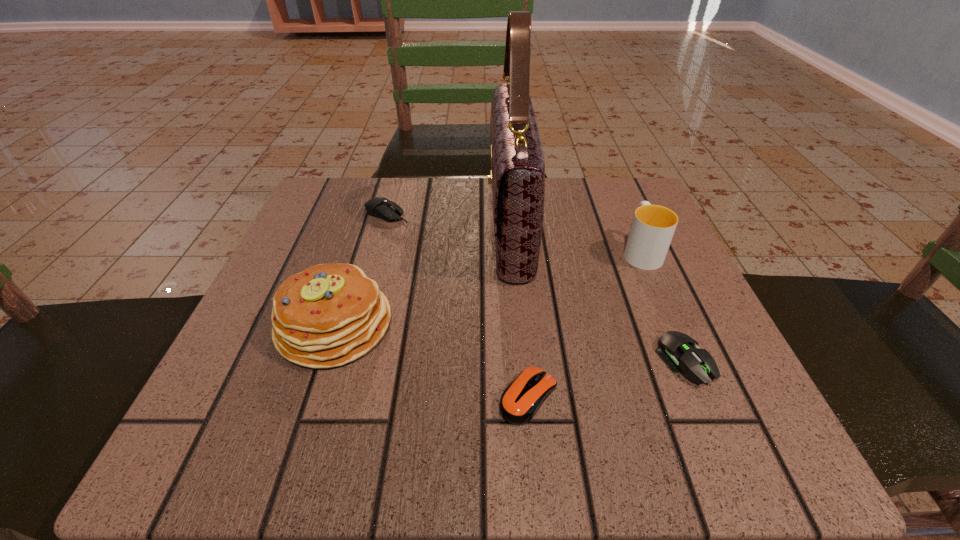
The width and height of the screenshot is (960, 540). I want to click on the tallest object, so click(517, 176).

What are the coordinates of `cup` in the screenshot? It's located at pos(653,226).

This screenshot has height=540, width=960. Identify the location of pancake. (328, 315).

The height and width of the screenshot is (540, 960). I want to click on the leftmost computer mouse, so click(383, 208).

The image size is (960, 540). What are the coordinates of `the second computer mouse from left to right` in the screenshot? It's located at (521, 400).

What are the coordinates of `the rightmost computer mouse` in the screenshot? It's located at (675, 348).

The width and height of the screenshot is (960, 540). I want to click on vacant region located 0.050m on the front of the handbag with the clasp, so click(463, 224).

You are a GUI agent. You are given a task and a screenshot of the screen. Output one action in this format:
    pyautogui.click(x=<x>, y=<y>)
    Task: Click on the free space located on the front of the handbag with the clasp
    
    Given the screenshot: What is the action you would take?
    pyautogui.click(x=429, y=224)

Where is `blank space located on the front of the handbag with the clasp`? blank space located on the front of the handbag with the clasp is located at coordinates (356, 224).

You are a GUI agent. You are given a task and a screenshot of the screen. Output one action in this format:
    pyautogui.click(x=<x>, y=<y>)
    Task: Click on the vacant space located with the handle on the side of the cup
    The width and height of the screenshot is (960, 540).
    Given the screenshot: What is the action you would take?
    pyautogui.click(x=613, y=187)